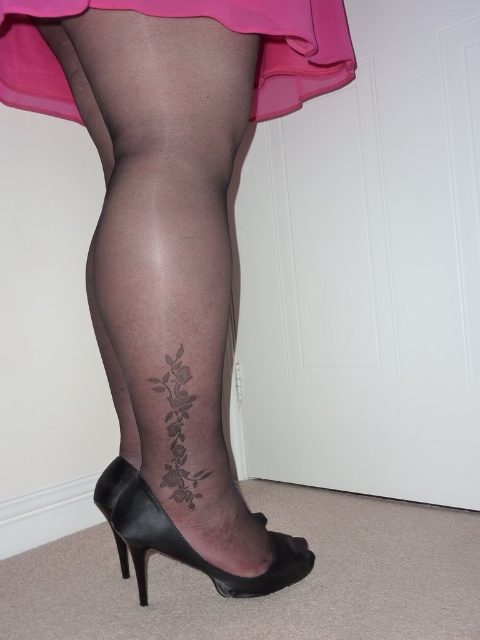
Describe the element at coordinates (182, 538) in the screenshot. I see `black leather shoe at lower center` at that location.

Can you confirm if black leather shoe at lower center is thinner than black ink rose at lower left?

In fact, black leather shoe at lower center might be wider than black ink rose at lower left.

Is point (99, 477) farther from camera compared to point (189, 417)?

Yes, it is.

The image size is (480, 640). Find the location of `black leather shoe at lower center`. black leather shoe at lower center is located at coordinates (182, 538).

Can you confirm if sheer black tights at center is positioned to the left of black ink rose at lower left?

Indeed, sheer black tights at center is positioned on the left side of black ink rose at lower left.

Does point (193, 156) come closer to viewer compared to point (155, 381)?

Yes.

Where is `sheer black tights at center`? The width and height of the screenshot is (480, 640). sheer black tights at center is located at coordinates pyautogui.click(x=172, y=240).

Measure the distance from matte pink fabric at upper center to black leather shoe at lower center.

The distance of matte pink fabric at upper center from black leather shoe at lower center is 35.71 inches.

Is point (323, 1) farther from camera compared to point (278, 566)?

No.

The height and width of the screenshot is (640, 480). In order to click on matte pink fabric at upper center in this screenshot , I will do `click(190, 17)`.